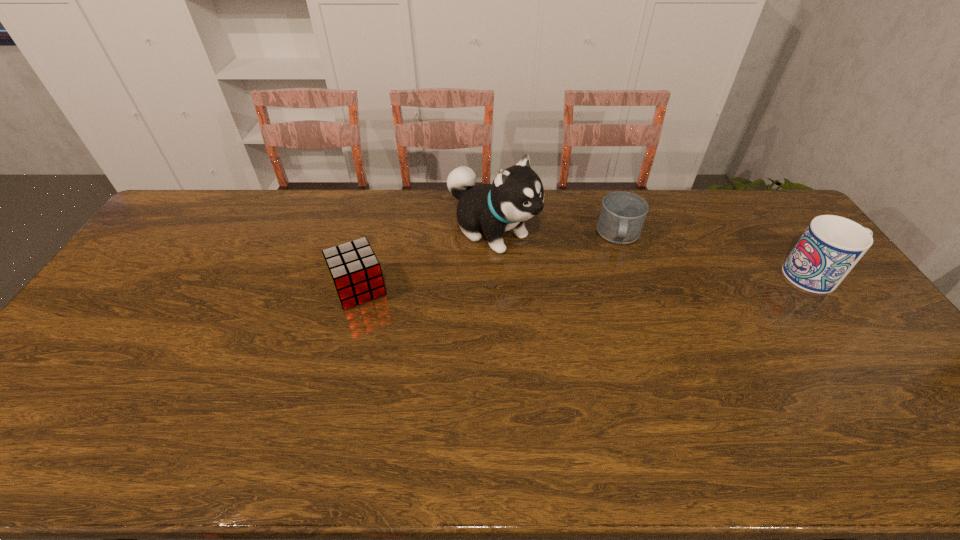
Find the location of `vacant space at the left edge`. vacant space at the left edge is located at coordinates (182, 258).

Find the location of `free space at the right edge of the desktop`. free space at the right edge of the desktop is located at coordinates (853, 322).

At what (x,y) coordinates should I click in order to perform the action: click on vacant space at the far left corner of the desktop. Please return your answer as a coordinate pair (x, y). Looking at the image, I should click on (x=201, y=192).

Locate an element on the screen. vacant space at the far right corner is located at coordinates (780, 221).

What are the coordinates of `blank area at the near right corner` in the screenshot? It's located at (897, 387).

The height and width of the screenshot is (540, 960). Find the location of `vacant area that lies between the leftmost object and the nearer mug`. vacant area that lies between the leftmost object and the nearer mug is located at coordinates (589, 282).

Where is `free space between the leftmost object and the third shortest object`? Image resolution: width=960 pixels, height=540 pixels. free space between the leftmost object and the third shortest object is located at coordinates (589, 282).

In order to click on free spot between the left mug and the tallest object in this screenshot , I will do `click(556, 233)`.

This screenshot has height=540, width=960. Identify the location of unoccupied position between the cube and the puppy. (425, 260).

Identify the location of free space between the third shortest object and the second object from left to right. (656, 253).